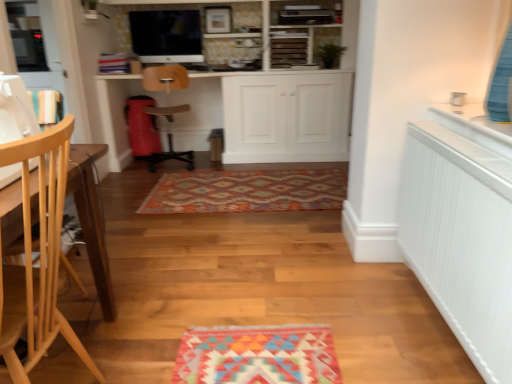
Question: Is white matte cabinet at center to the right of light wood chair at left, arranged as the second chair when viewed from the back, from the viewer's perspective?

Choices:
 (A) no
 (B) yes

Answer: (B)

Question: Considering the relative sizes of white matte cabinet at center and light wood chair at left, which appears as the 1th chair when viewed from the front, in the image provided, is white matte cabinet at center shorter than light wood chair at left, which appears as the 1th chair when viewed from the front,?

Choices:
 (A) no
 (B) yes

Answer: (B)

Question: Considering the relative sizes of white matte cabinet at center and light wood chair at left, arranged as the 1th chair when ordered from the bottom, in the image provided, is white matte cabinet at center smaller than light wood chair at left, arranged as the 1th chair when ordered from the bottom,?

Choices:
 (A) no
 (B) yes

Answer: (A)

Question: Is white matte cabinet at center positioned behind light wood chair at left, which appears as the second chair when viewed from the top?

Choices:
 (A) yes
 (B) no

Answer: (A)

Question: Is white matte cabinet at center in front of light wood chair at left, which appears as the second chair when viewed from the top?

Choices:
 (A) yes
 (B) no

Answer: (B)

Question: Considering the relative positions of wooden at center, placed as the 1th chair when sorted from back to front, and wooden sewing machine at left in the image provided, is wooden at center, placed as the 1th chair when sorted from back to front, to the left or to the right of wooden sewing machine at left?

Choices:
 (A) right
 (B) left

Answer: (B)

Question: Is wooden at center, the second chair in the bottom-to-top sequence, wider or thinner than wooden sewing machine at left?

Choices:
 (A) wide
 (B) thin

Answer: (A)

Question: Does point pyautogui.click(x=164, y=155) appear closer or farther from the camera than point pyautogui.click(x=11, y=84)?

Choices:
 (A) farther
 (B) closer

Answer: (A)

Question: In terms of size, does wooden at center, the second chair in the bottom-to-top sequence, appear bigger or smaller than wooden sewing machine at left?

Choices:
 (A) big
 (B) small

Answer: (A)

Question: Does point [33, 322] appear closer or farther from the camera than point [152, 107]?

Choices:
 (A) closer
 (B) farther

Answer: (A)

Question: Is light wood chair at left, arranged as the 1th chair when ordered from the bottom, wider or thinner than wooden at center, the second chair in the bottom-to-top sequence?

Choices:
 (A) wide
 (B) thin

Answer: (B)

Question: From the image's perspective, relative to wooden at center, the second chair in the bottom-to-top sequence, is light wood chair at left, arranged as the second chair when viewed from the back, above or below?

Choices:
 (A) below
 (B) above

Answer: (A)

Question: From a real-world perspective, is light wood chair at left, arranged as the 1th chair when ordered from the bottom, physically located above or below wooden at center, the 2th chair from the front?

Choices:
 (A) above
 (B) below

Answer: (A)

Question: Is satin black monitor at upper center in front of or behind light wood chair at left, which appears as the second chair when viewed from the top, in the image?

Choices:
 (A) front
 (B) behind

Answer: (B)

Question: Looking at their shapes, would you say satin black monitor at upper center is wider or thinner than light wood chair at left, which appears as the second chair when viewed from the top?

Choices:
 (A) wide
 (B) thin

Answer: (B)